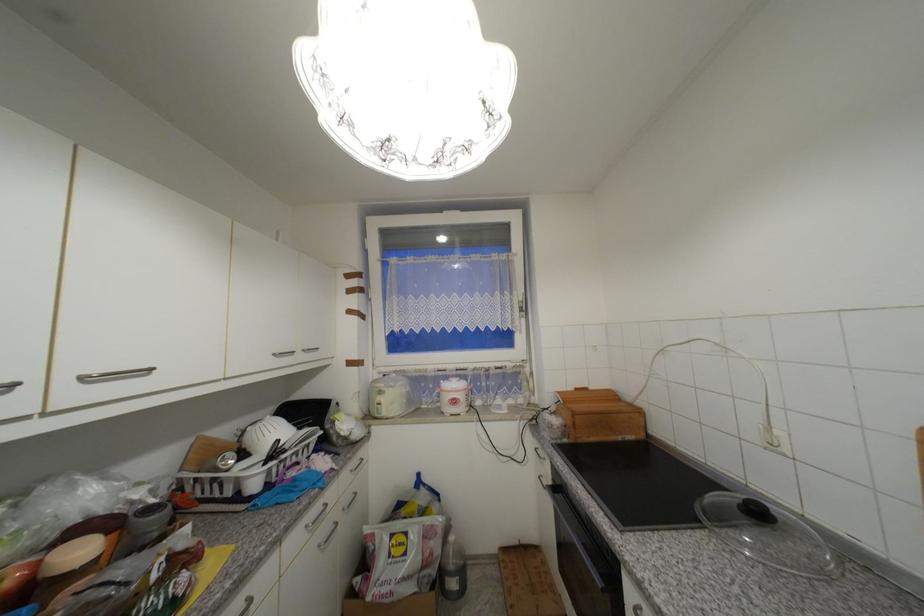
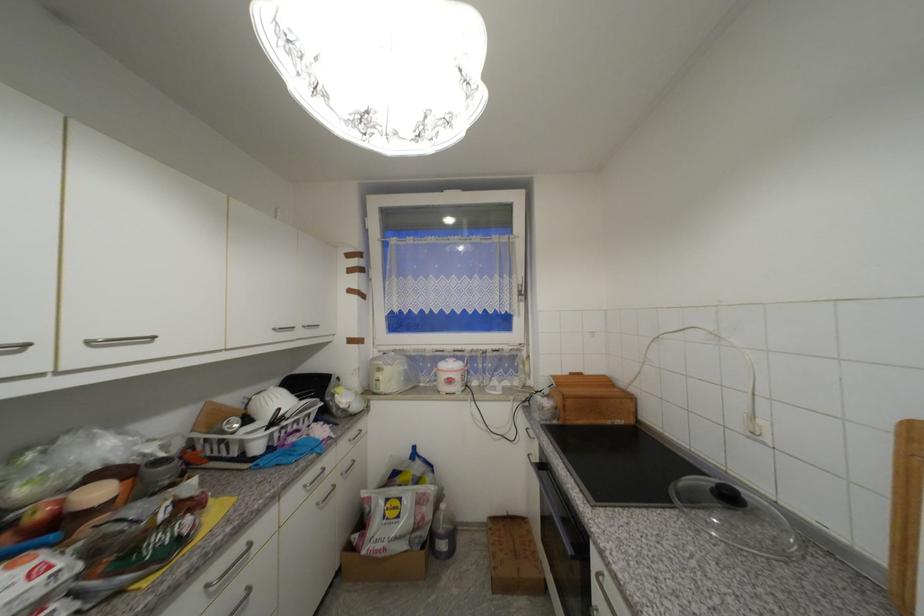
Question: Based on the continuous images, in which direction is the camera rotating? Reply with the corresponding letter.

Choices:
 (A) Left
 (B) Right
 (C) Up
 (D) Down

Answer: (D)